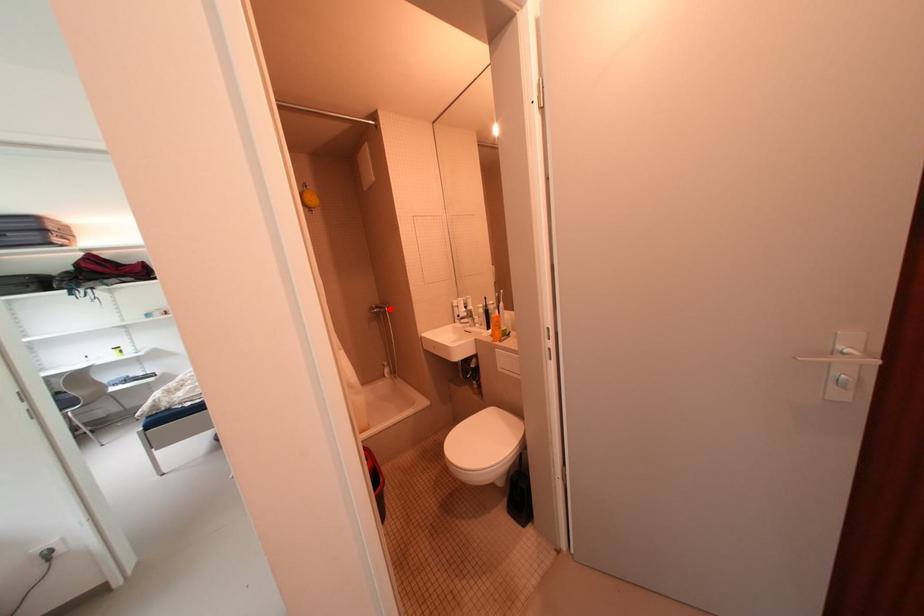
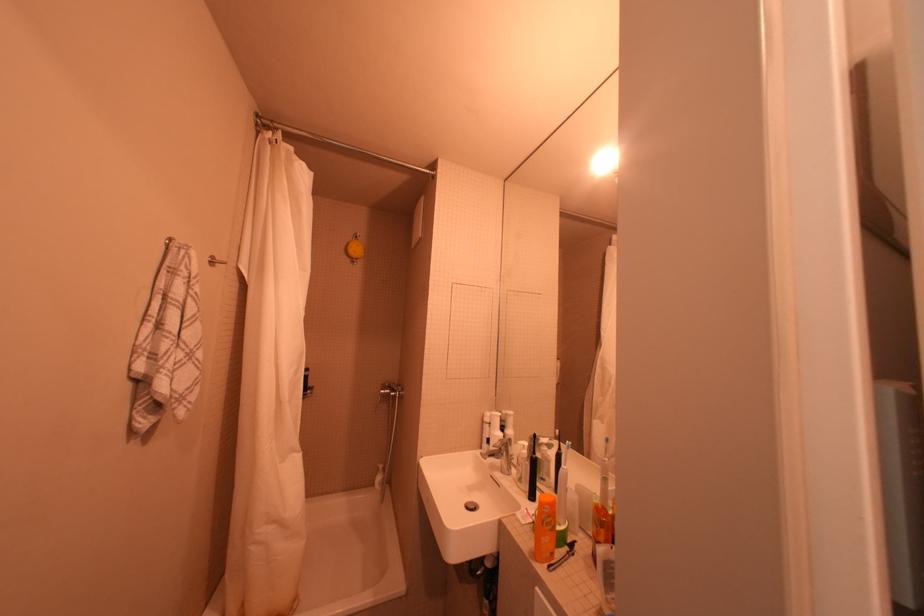
Question: I am providing you with two images of the same scene from different viewpoints. A red point is shown in image1. For the corresponding object point in image2, is it positioned nearer or farther from the camera?

Choices:
 (A) Nearer
 (B) Farther

Answer: (B)